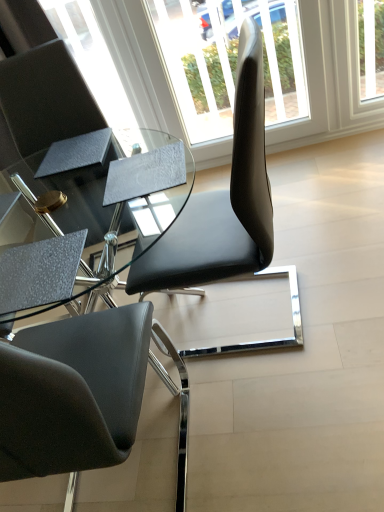
Locate an element on the screen. This screenshot has width=384, height=512. free space in front of transparent glass window at center is located at coordinates (311, 192).